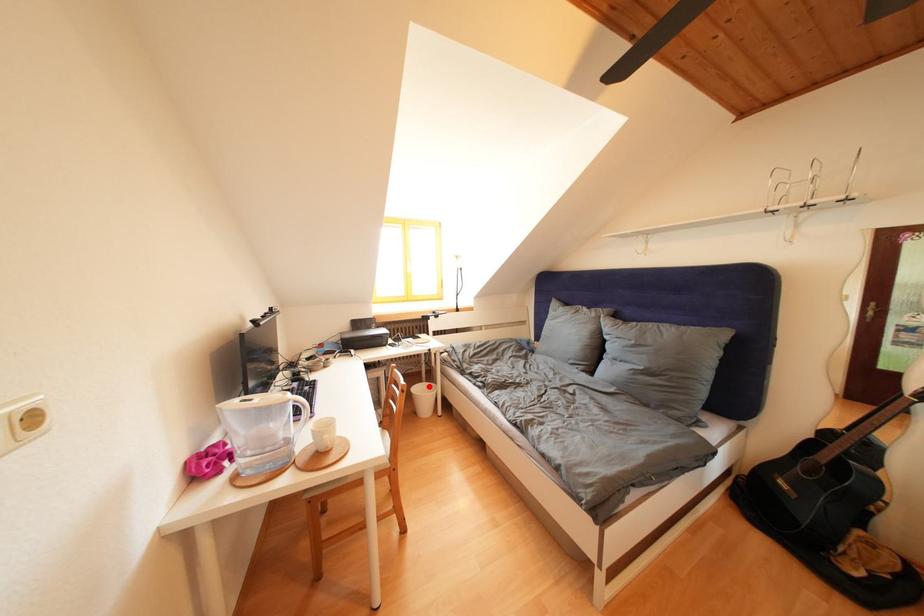
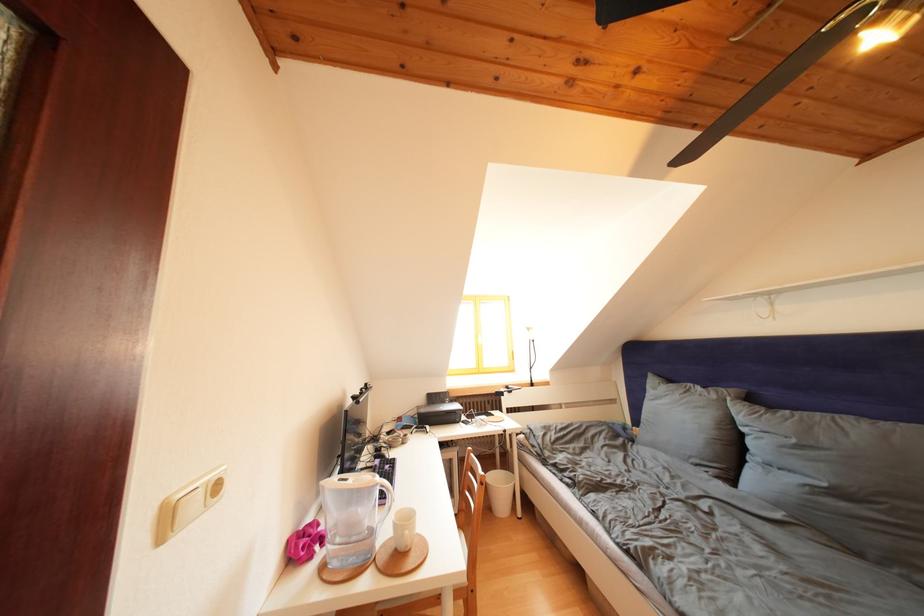
Question: I am providing you with two images of the same scene from different viewpoints. A red point is shown in image1. For the corresponding object point in image2, is it positioned nearer or farther from the camera?

Choices:
 (A) Nearer
 (B) Farther

Answer: (B)